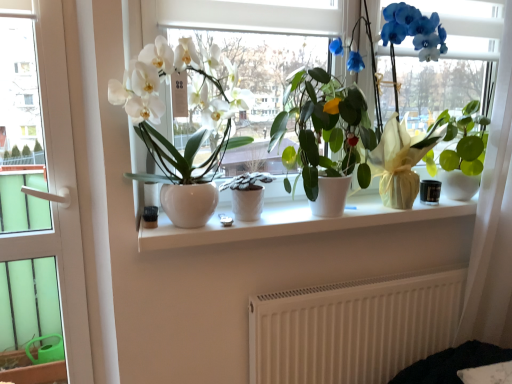
Measure the distance between point [447,313] and camera.

Point [447,313] is 5.32 feet away from camera.

What do you see at coordinates (247, 195) in the screenshot? I see `white textured pot at center, the second houseplant in the left-to-right sequence` at bounding box center [247, 195].

Where is `green glossy leafy plant at right, which is the 1th houseplant from right to left`? green glossy leafy plant at right, which is the 1th houseplant from right to left is located at coordinates (463, 152).

The image size is (512, 384). Identify the location of matte white vase at center, which is the first houseplant in left-to-right order. (192, 134).

The height and width of the screenshot is (384, 512). I want to click on white matte radiator at lower center, so click(x=353, y=328).

From a real-world perspective, is matte white vase at center, acting as the 3th houseplant starting from the right, beneath white textured pot at center, which appears as the 2th houseplant when viewed from the right?

No, from a real-world perspective, matte white vase at center, acting as the 3th houseplant starting from the right, is not beneath white textured pot at center, which appears as the 2th houseplant when viewed from the right.

Could you tell me if matte white vase at center, which is the first houseplant in left-to-right order, is facing white textured pot at center, the second houseplant in the left-to-right sequence?

No.

Is there a large distance between matte white vase at center, which is the first houseplant in left-to-right order, and white textured pot at center, which appears as the 2th houseplant when viewed from the right?

No, matte white vase at center, which is the first houseplant in left-to-right order, is not far away from white textured pot at center, which appears as the 2th houseplant when viewed from the right.

Is matte white vase at center, acting as the 3th houseplant starting from the right, closer to the viewer compared to white textured pot at center, the second houseplant in the left-to-right sequence?

Yes, the depth of matte white vase at center, acting as the 3th houseplant starting from the right, is less than that of white textured pot at center, the second houseplant in the left-to-right sequence.

Based on their sizes in the image, would you say white textured pot at center, which appears as the 2th houseplant when viewed from the right, is bigger or smaller than matte white vase at center, which is the first houseplant in left-to-right order?

Clearly, white textured pot at center, which appears as the 2th houseplant when viewed from the right, is smaller in size than matte white vase at center, which is the first houseplant in left-to-right order.

Is white textured pot at center, which appears as the 2th houseplant when viewed from the right, turned away from matte white vase at center, acting as the 3th houseplant starting from the right?

Answer: Yes, white textured pot at center, which appears as the 2th houseplant when viewed from the right, is facing away from matte white vase at center, acting as the 3th houseplant starting from the right.

In terms of width, does white textured pot at center, which appears as the 2th houseplant when viewed from the right, look wider or thinner when compared to matte white vase at center, which is the first houseplant in left-to-right order?

Considering their sizes, white textured pot at center, which appears as the 2th houseplant when viewed from the right, looks slimmer than matte white vase at center, which is the first houseplant in left-to-right order.

You are a GUI agent. You are given a task and a screenshot of the screen. Output one action in this format:
    pyautogui.click(x=<x>, y=<y>)
    Task: Click on the 1st houseplant counting from the right side of the matte white vase at center, which is the first houseplant in left-to-right order
    Image resolution: width=512 pixels, height=384 pixels.
    Given the screenshot: What is the action you would take?
    pyautogui.click(x=247, y=195)

From a real-world perspective, is white matte radiator at lower center physically below green glossy leafy plant at right, acting as the 3th houseplant starting from the left?

Yes.

Considering the sizes of white matte radiator at lower center and green glossy leafy plant at right, acting as the 3th houseplant starting from the left, in the image, is white matte radiator at lower center bigger or smaller than green glossy leafy plant at right, acting as the 3th houseplant starting from the left,?

In the image, white matte radiator at lower center appears to be larger than green glossy leafy plant at right, acting as the 3th houseplant starting from the left.

Is the surface of white matte radiator at lower center in direct contact with green glossy leafy plant at right, acting as the 3th houseplant starting from the left?

white matte radiator at lower center is not next to green glossy leafy plant at right, acting as the 3th houseplant starting from the left, and they're not touching.

Is point (350, 291) behind point (481, 139)?

That is True.

Can you tell me how much white glossy vase at center and white sheer curtain at right differ in facing direction?

The facing directions of white glossy vase at center and white sheer curtain at right are 0.212 degrees apart.

From the image's perspective, which one is positioned higher, white glossy vase at center or white sheer curtain at right?

white glossy vase at center.

Would you say white sheer curtain at right is part of white glossy vase at center's contents?

No, white sheer curtain at right is located outside of white glossy vase at center.

Is point (435, 7) behind point (499, 308)?

No, (435, 7) is in front of (499, 308).

Considering the sizes of white glossy vase at center and white textured pot at center, which appears as the 2th houseplant when viewed from the right, in the image, is white glossy vase at center taller or shorter than white textured pot at center, which appears as the 2th houseplant when viewed from the right,?

white glossy vase at center is taller than white textured pot at center, which appears as the 2th houseplant when viewed from the right.

Looking at their sizes, would you say white glossy vase at center is wider or thinner than white textured pot at center, the second houseplant in the left-to-right sequence?

white glossy vase at center is thinner than white textured pot at center, the second houseplant in the left-to-right sequence.

Locate an element on the screen. houseplant that is the 3rd object located below the white glossy vase at center (from the image's perspective) is located at coordinates (247, 195).

Would you say white matte radiator at lower center is a long distance from white glossy vase at center?

No, white matte radiator at lower center is not far from white glossy vase at center.

In terms of height, does white matte radiator at lower center look taller or shorter compared to white glossy vase at center?

white matte radiator at lower center is shorter than white glossy vase at center.

Is point (151, 117) closer or farther from the camera than point (478, 205)?

Point (151, 117) appears to be closer to the viewer than point (478, 205).

From a real-world perspective, does matte white vase at center, acting as the 3th houseplant starting from the right, sit lower than white sheer curtain at right?

Incorrect, from a real-world perspective, matte white vase at center, acting as the 3th houseplant starting from the right, is higher than white sheer curtain at right.

Is matte white vase at center, which is the first houseplant in left-to-right order, taller or shorter than white sheer curtain at right?

matte white vase at center, which is the first houseplant in left-to-right order, is shorter than white sheer curtain at right.

The width and height of the screenshot is (512, 384). What are the coordinates of `curtain lying below the matte white vase at center, which is the first houseplant in left-to-right order (from the image's perspective)` in the screenshot? It's located at (493, 220).

Locate an element on the screen. The height and width of the screenshot is (384, 512). the 2nd houseplant located above the white textured pot at center, the second houseplant in the left-to-right sequence (from a real-world perspective) is located at coordinates (192, 134).

Where is `houseplant that is the 1st object to the right of the matte white vase at center, acting as the 3th houseplant starting from the right, starting at the anchor`? This screenshot has height=384, width=512. houseplant that is the 1st object to the right of the matte white vase at center, acting as the 3th houseplant starting from the right, starting at the anchor is located at coordinates (247, 195).

Considering their positions, is white ceramic window sill at center positioned closer to white glossy vase at center than white matte radiator at lower center?

white ceramic window sill at center is positioned closer to the anchor white glossy vase at center.

Which object lies further to the anchor point white matte radiator at lower center, white ceramic window sill at center or green glossy leafy plant at right, acting as the 3th houseplant starting from the left?

green glossy leafy plant at right, acting as the 3th houseplant starting from the left.

Estimate the real-world distances between objects in this image. Which object is further from white ceramic window sill at center, white textured pot at center, the second houseplant in the left-to-right sequence, or white glossy vase at center?

white glossy vase at center lies further to white ceramic window sill at center than the other object.

Which object lies further to the anchor point white textured pot at center, the second houseplant in the left-to-right sequence, white matte radiator at lower center or white glossy vase at center?

white matte radiator at lower center is positioned further to the anchor white textured pot at center, the second houseplant in the left-to-right sequence.

When comparing their distances from white ceramic window sill at center, does matte white vase at center, which is the first houseplant in left-to-right order, or white textured pot at center, which appears as the 2th houseplant when viewed from the right, seem further?

matte white vase at center, which is the first houseplant in left-to-right order, is further to white ceramic window sill at center.

Based on their spatial positions, is matte white vase at center, which is the first houseplant in left-to-right order, or white sheer curtain at right closer to white ceramic window sill at center?

matte white vase at center, which is the first houseplant in left-to-right order.

In the scene shown: Based on their spatial positions, is white matte radiator at lower center or white sheer curtain at right closer to white textured pot at center, the second houseplant in the left-to-right sequence?

Among the two, white matte radiator at lower center is located nearer to white textured pot at center, the second houseplant in the left-to-right sequence.

Which object lies further to the anchor point green glossy leafy plant at right, which is the 1th houseplant from right to left, white sheer curtain at right or white glossy vase at center?

Based on the image, white glossy vase at center appears to be further to green glossy leafy plant at right, which is the 1th houseplant from right to left.

At what (x,y) coordinates should I click in order to perform the action: click on radiator situated between white textured pot at center, which appears as the 2th houseplant when viewed from the right, and white sheer curtain at right from left to right. Please return your answer as a coordinate pair (x, y). The image size is (512, 384). Looking at the image, I should click on (353, 328).

Where is `window screen between matte white vase at center, acting as the 3th houseplant starting from the right, and green glossy leafy plant at right, acting as the 3th houseplant starting from the left, from left to right`? window screen between matte white vase at center, acting as the 3th houseplant starting from the right, and green glossy leafy plant at right, acting as the 3th houseplant starting from the left, from left to right is located at coordinates (264, 15).

Identify the location of houseplant located between white textured pot at center, which appears as the 2th houseplant when viewed from the right, and white sheer curtain at right in the left-right direction. Image resolution: width=512 pixels, height=384 pixels. (463, 152).

The width and height of the screenshot is (512, 384). In order to click on houseplant situated between matte white vase at center, acting as the 3th houseplant starting from the right, and white glossy vase at center from left to right in this screenshot , I will do `click(247, 195)`.